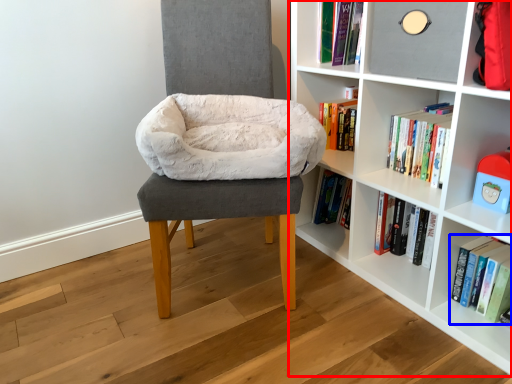
Question: Which of the following is the farthest to the observer, shelf (highlighted by a red box) or book (highlighted by a blue box)?

Choices:
 (A) shelf
 (B) book

Answer: (B)